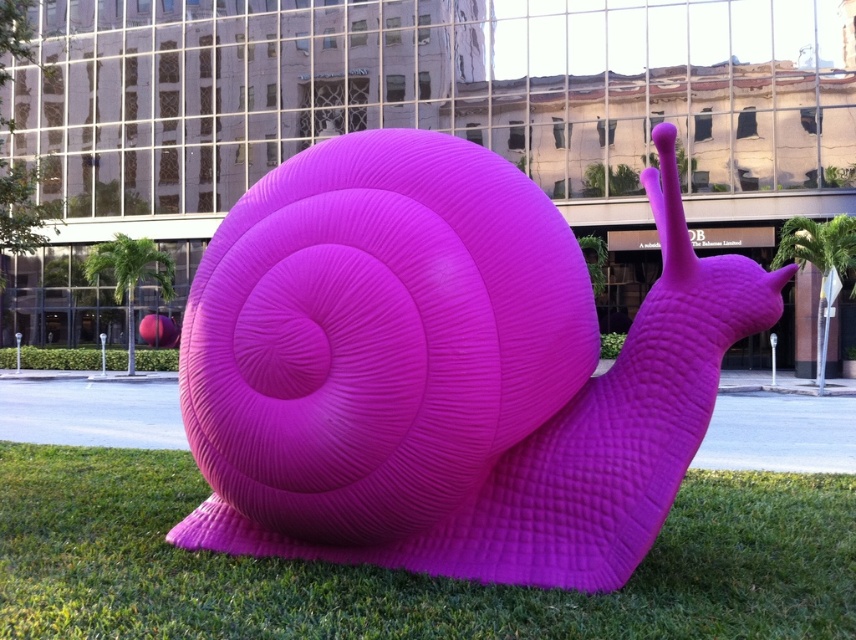
Question: Does matte plastic snail at center appear on the right side of green grass at center?

Choices:
 (A) yes
 (B) no

Answer: (B)

Question: Which point is farther to the camera?

Choices:
 (A) matte plastic snail at center
 (B) green grass at center

Answer: (B)

Question: In this image, where is matte plastic snail at center located relative to green grass at center?

Choices:
 (A) below
 (B) above

Answer: (B)

Question: Does matte plastic snail at center have a greater width compared to green grass at center?

Choices:
 (A) yes
 (B) no

Answer: (A)